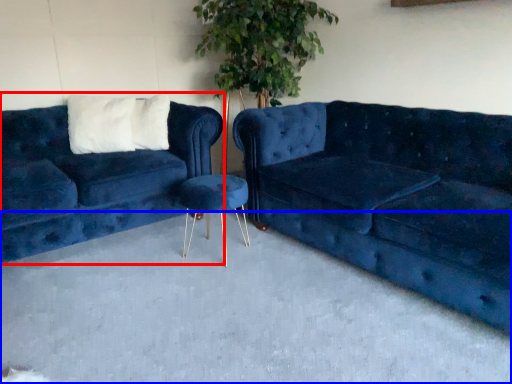
Question: Which object is further to the camera taking this photo, studio couch (highlighted by a red box) or concrete (highlighted by a blue box)?

Choices:
 (A) studio couch
 (B) concrete

Answer: (A)